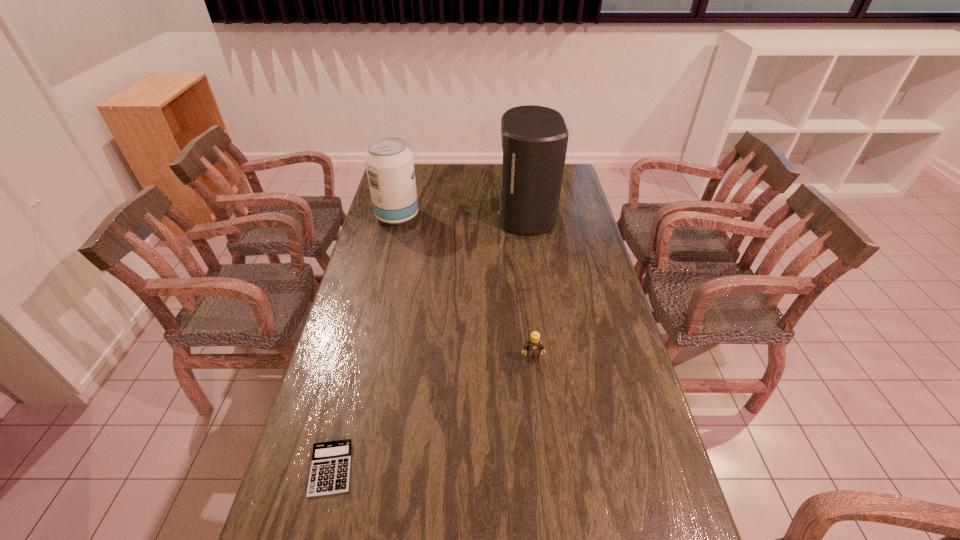
Where is `free space located 0.100m in front of the third farthest object`? free space located 0.100m in front of the third farthest object is located at coordinates (536, 390).

Locate an element on the screen. The height and width of the screenshot is (540, 960). vacant region located 0.240m on the right of the shortest object is located at coordinates (451, 469).

This screenshot has width=960, height=540. I want to click on alcohol at the left edge, so click(x=389, y=163).

This screenshot has width=960, height=540. In order to click on calculator that is at the left edge in this screenshot , I will do 330,469.

The height and width of the screenshot is (540, 960). What are the coordinates of `object positioned at the right edge` in the screenshot? It's located at (534, 139).

The width and height of the screenshot is (960, 540). In order to click on free region at the far edge of the desktop in this screenshot , I will do click(x=478, y=183).

Image resolution: width=960 pixels, height=540 pixels. What are the coordinates of `vacant region at the left edge of the desktop` in the screenshot? It's located at (338, 404).

The width and height of the screenshot is (960, 540). In order to click on vacant position at the right edge of the desktop in this screenshot , I will do `click(617, 418)`.

Locate an element on the screen. Image resolution: width=960 pixels, height=540 pixels. unoccupied position between the alcohol and the Lego is located at coordinates (465, 287).

You are a GUI agent. You are given a task and a screenshot of the screen. Output one action in this format:
    pyautogui.click(x=<x>, y=<y>)
    Task: Click on the free space between the alcohol and the shortest object
    
    Given the screenshot: What is the action you would take?
    pyautogui.click(x=364, y=342)